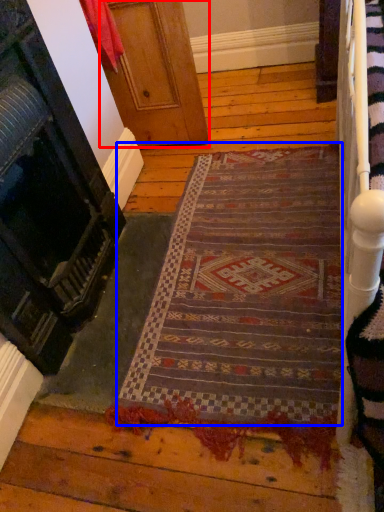
Question: Among these objects, which one is farthest to the camera, door (highlighted by a red box) or mat (highlighted by a blue box)?

Choices:
 (A) door
 (B) mat

Answer: (A)